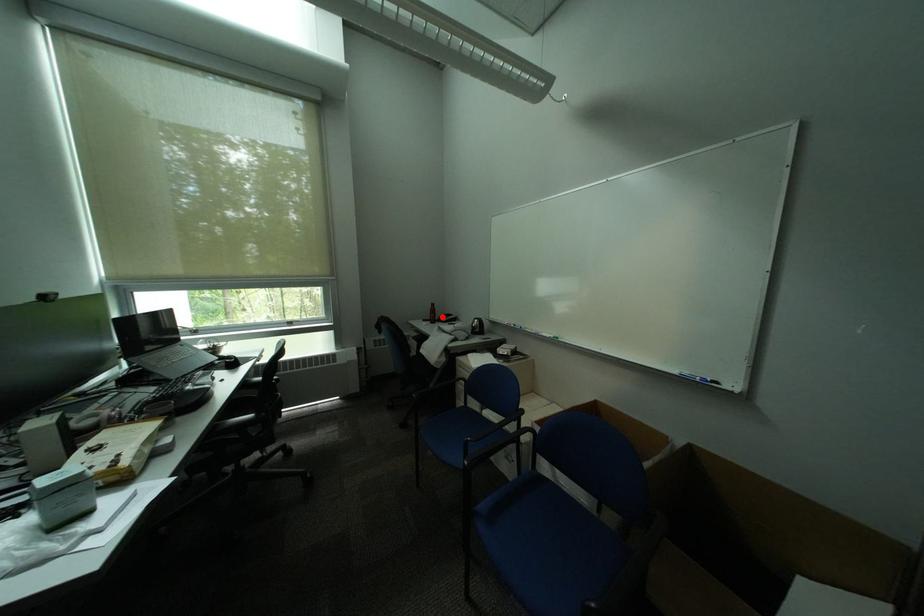
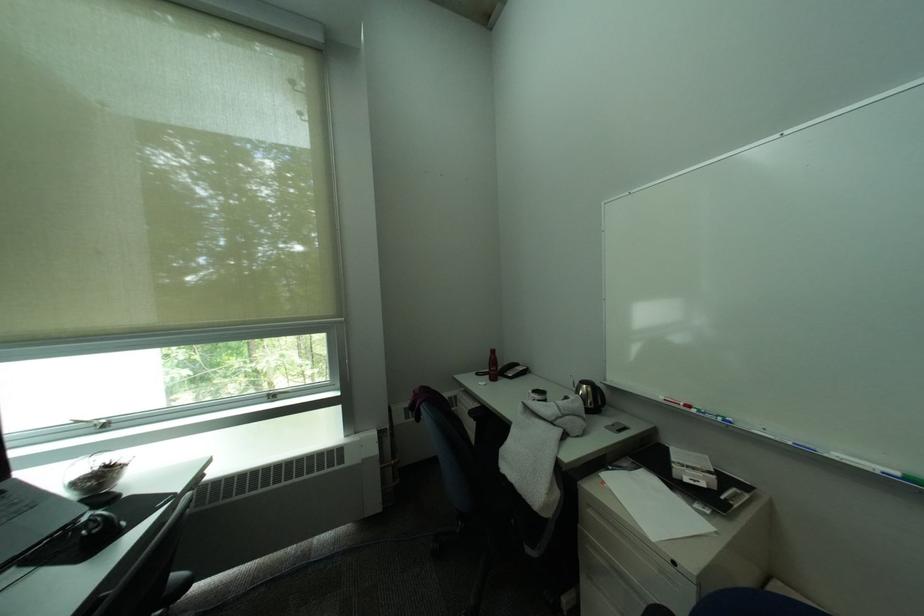
Question: A red point is marked in image1. In image2, is the corresponding 3D point closer to the camera or farther? Reply with the corresponding letter.

Choices:
 (A) The corresponding 3D point is closer.
 (B) The corresponding 3D point is farther.

Answer: (B)